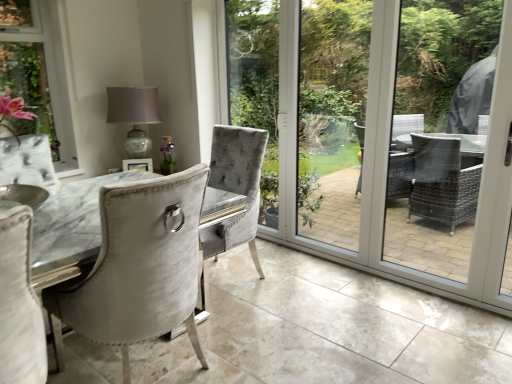
Find the location of a particular element. free region under clear glass screen door at center, the 1th screen door viewed from the left (from a real-world perspective) is located at coordinates (340, 264).